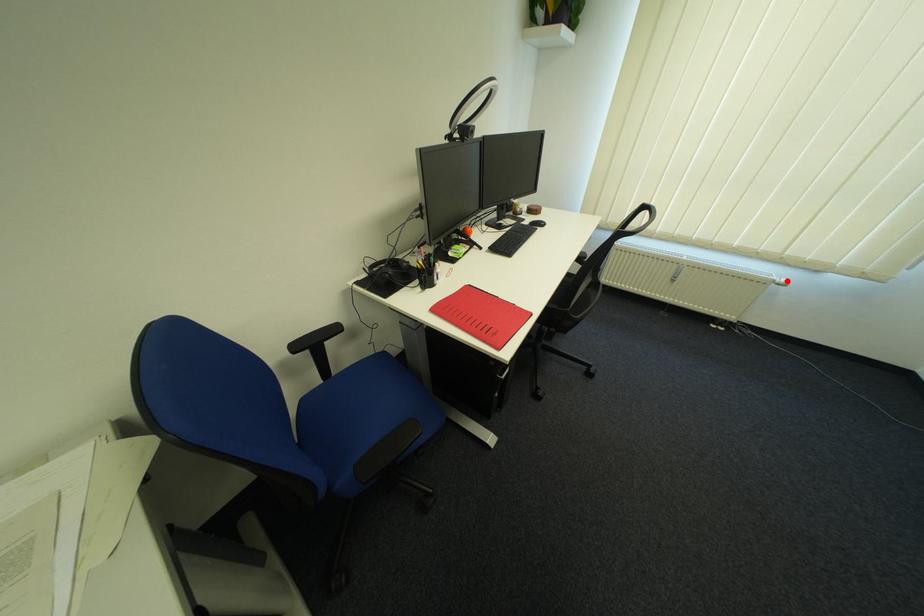
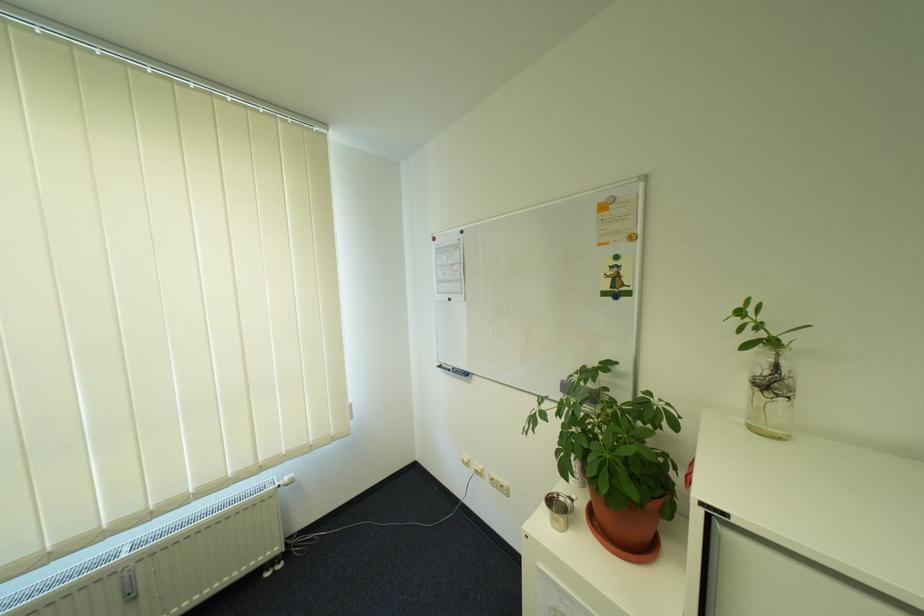
Where in the second image is the point corresponding to the highlighted location from the first image?

(290, 484)